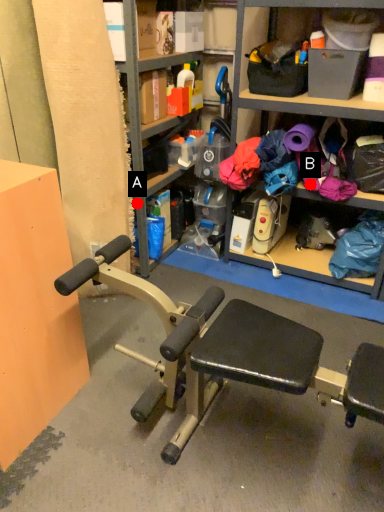
Question: Two points are circled on the image, labeled by A and B beside each circle. Which of the following is the farthest from the observer?

Choices:
 (A) A is further
 (B) B is further

Answer: (A)